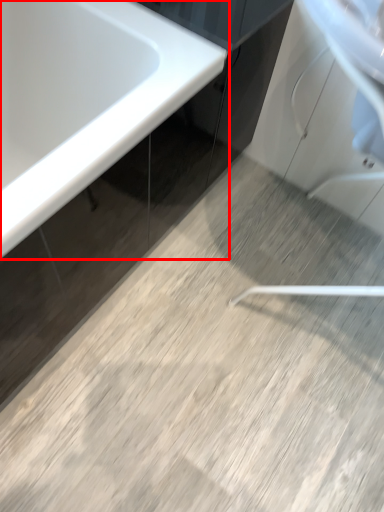
Question: From the image's perspective, what is the correct spatial positioning of bathtub (annotated by the red box) in reference to cabinetry?

Choices:
 (A) below
 (B) above

Answer: (A)